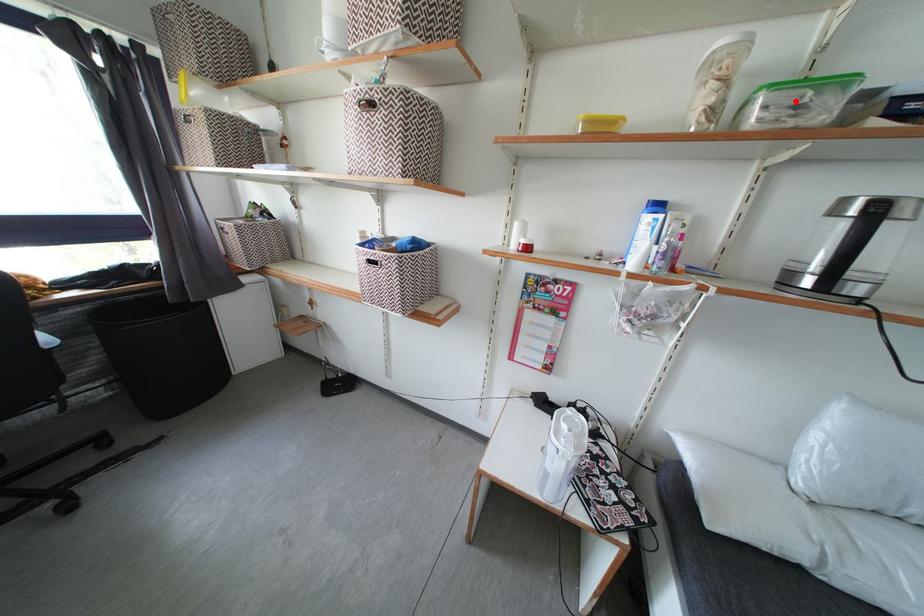
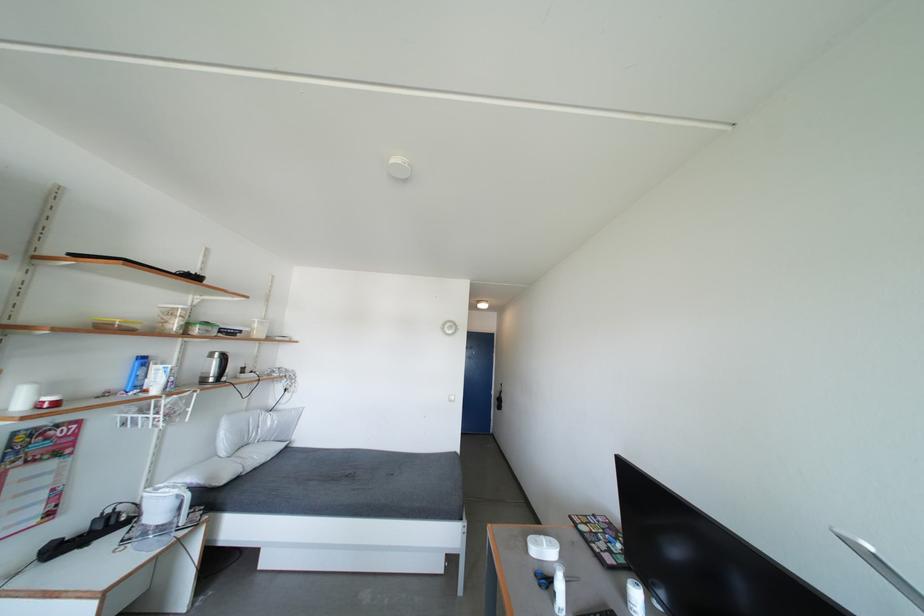
Find the pixel in the second image that matches the highlighted location in the first image.

(212, 333)